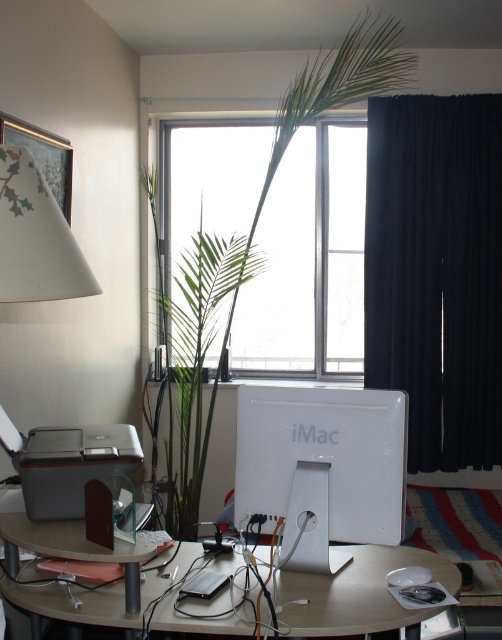
You are a photographer setting up a shot of the dark blue fabric curtain at right. You have a camera that can focus up to 3 meters. Can you capture the curtain clearly from where you are standing?

The dark blue fabric curtain at right and camera are 3.28 meters apart from each other. Since the camera can only focus up to 3 meters, it cannot capture the curtain clearly from that distance.

Consider the image. You are organizing the items on the desk and notice the transparent glass window at center and the green leafy plant at center. Which one is taller?

The green leafy plant at center is taller than the transparent glass window at center.

Looking at this image, you are organizing the workspace and need to move the dark blue fabric curtain at right and the green leafy plant at center. Which object is closer to you so you can reach it first without moving around?

The dark blue fabric curtain at right is closer to you, so you can reach it first without moving around because it is further to the viewer than the green leafy plant at center.